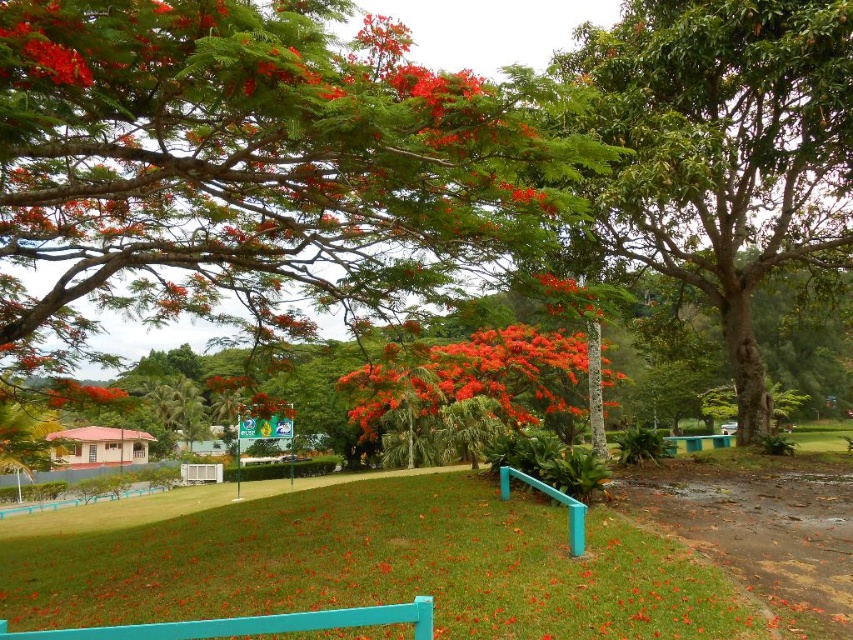
Question: Among these objects, which one is nearest to the camera?

Choices:
 (A) bright orange flower at center
 (B) bright red flowers at center

Answer: (A)

Question: From the image, what is the correct spatial relationship of green glossy tree at center in relation to bright red petals at center?

Choices:
 (A) below
 (B) above

Answer: (B)

Question: Can you confirm if bright red flowers at center is smaller than bright orange flower at center?

Choices:
 (A) yes
 (B) no

Answer: (B)

Question: Can you confirm if green glossy tree at center is wider than bright orange flower at center?

Choices:
 (A) no
 (B) yes

Answer: (B)

Question: Which of the following is the farthest from the observer?

Choices:
 (A) bright orange flower at center
 (B) bright red petals at center
 (C) green glossy tree at center

Answer: (B)

Question: Which point appears farthest from the camera in this image?

Choices:
 (A) (48, 404)
 (B) (541, 291)

Answer: (A)